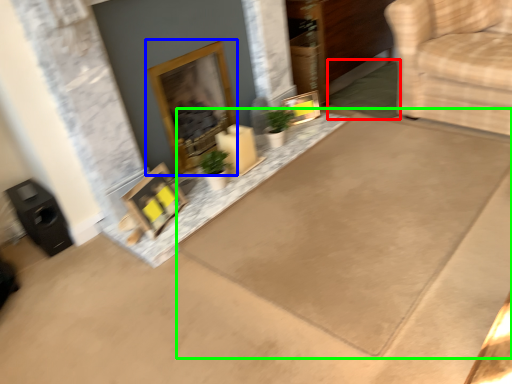
Question: Which object is positioned farthest from doormat (highlighted by a red box)? Select from fireplace (highlighted by a blue box) and doormat (highlighted by a green box).

Choices:
 (A) fireplace
 (B) doormat

Answer: (A)